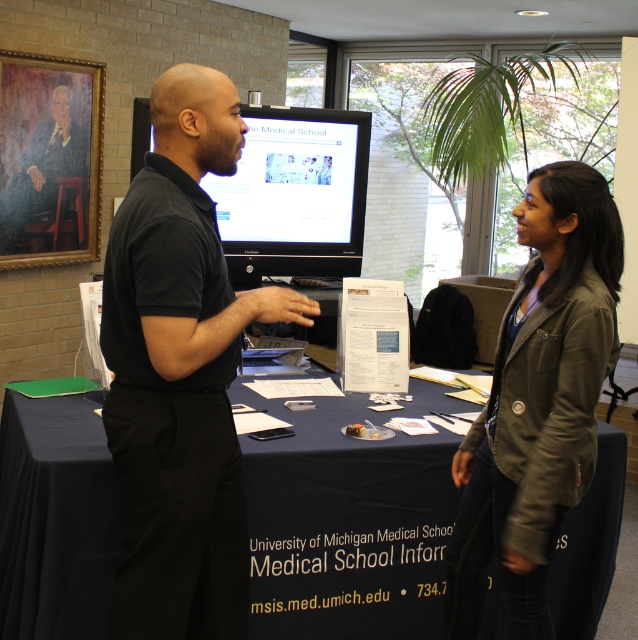
You are attending a University of Michigan Medical School event and notice two items on the table. You need to determine which one is shorter. Which object is shorter between the black matte shirt at center and the leather jacket at center?

The black matte shirt at center is shorter than the leather jacket at center according to the description.

You are a student attending a university event and need to retrieve your leather jacket at center. However, there is a matte black monitor at center in the way. Can you easily access your jacket without moving the monitor?

The leather jacket at center is positioned under the matte black monitor at center, so you can easily access it without moving the monitor by reaching underneath.

You are a student attending the University of Michigan Medical School event and need to place your leather jacket at center on the black fabric table at center. Can you do so without moving any other items on the table?

The black fabric table at center and leather jacket at center are 18.86 inches apart from each other. Since the distance between them is sufficient, you can place the leather jacket at center on the black fabric table at center without moving other items.